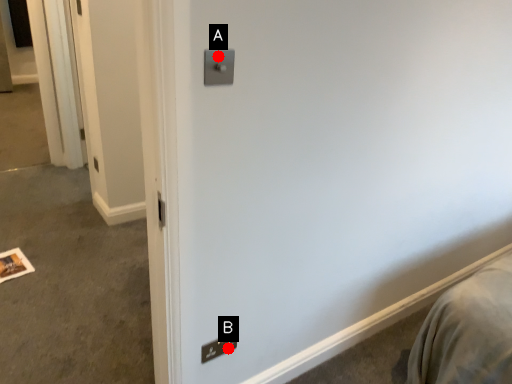
Question: Two points are circled on the image, labeled by A and B beside each circle. Among these points, which one is nearest to the camera?

Choices:
 (A) A is closer
 (B) B is closer

Answer: (A)